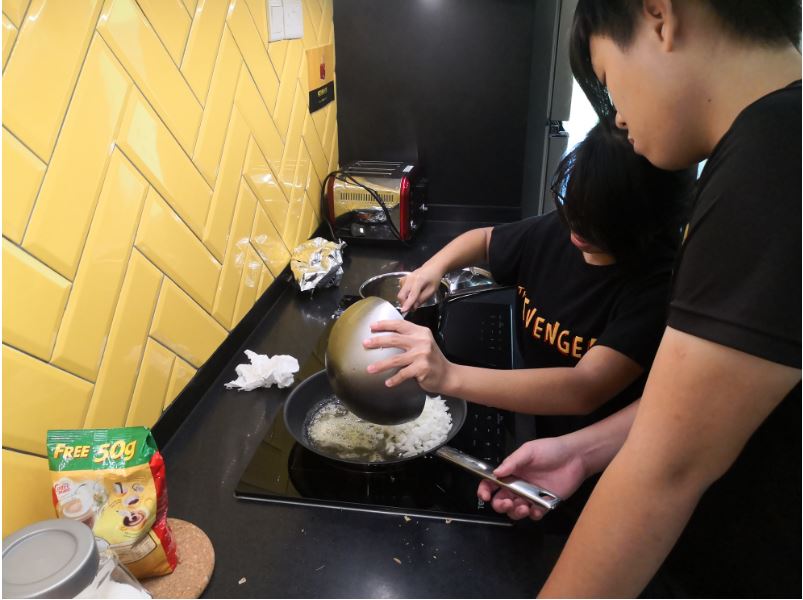
Image resolution: width=803 pixels, height=600 pixels. What are the coordinates of `bowl` in the screenshot? It's located at (356, 361).